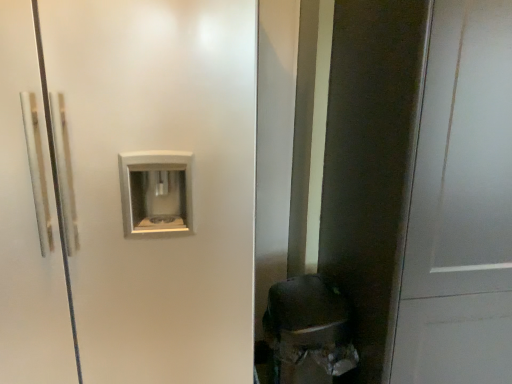
Question: From the image's perspective, is white matte screen door at center over matte black door at right?

Choices:
 (A) no
 (B) yes

Answer: (B)

Question: Is there a large distance between white matte screen door at center and matte black door at right?

Choices:
 (A) no
 (B) yes

Answer: (A)

Question: Is white matte screen door at center at the left side of matte black door at right?

Choices:
 (A) yes
 (B) no

Answer: (A)

Question: From the image's perspective, is white matte screen door at center below matte black door at right?

Choices:
 (A) no
 (B) yes

Answer: (A)

Question: From a real-world perspective, is white matte screen door at center beneath matte black door at right?

Choices:
 (A) yes
 (B) no

Answer: (B)

Question: Is matte black door at right surrounded by white matte screen door at center?

Choices:
 (A) yes
 (B) no

Answer: (B)

Question: Is matte black door at right at the right side of white matte screen door at center?

Choices:
 (A) yes
 (B) no

Answer: (A)

Question: Is matte black door at right smaller than white matte screen door at center?

Choices:
 (A) yes
 (B) no

Answer: (A)

Question: Does matte black door at right have a greater width compared to white matte screen door at center?

Choices:
 (A) yes
 (B) no

Answer: (B)

Question: Are matte black door at right and white matte screen door at center far apart?

Choices:
 (A) no
 (B) yes

Answer: (A)

Question: Can you confirm if matte black door at right is bigger than white matte screen door at center?

Choices:
 (A) no
 (B) yes

Answer: (A)

Question: Is matte black door at right touching white matte screen door at center?

Choices:
 (A) no
 (B) yes

Answer: (A)

Question: In the image, is matte black door at right positioned in front of or behind white matte screen door at center?

Choices:
 (A) behind
 (B) front

Answer: (B)